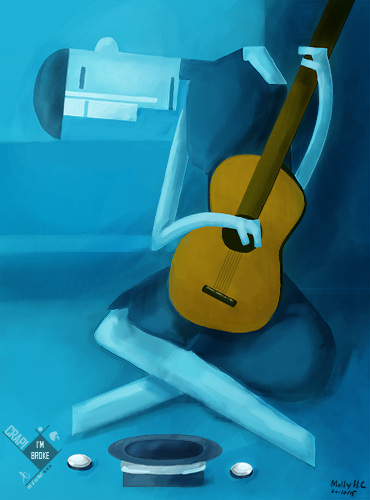
The width and height of the screenshot is (370, 500). I want to click on rectangular painting, so click(x=70, y=293).